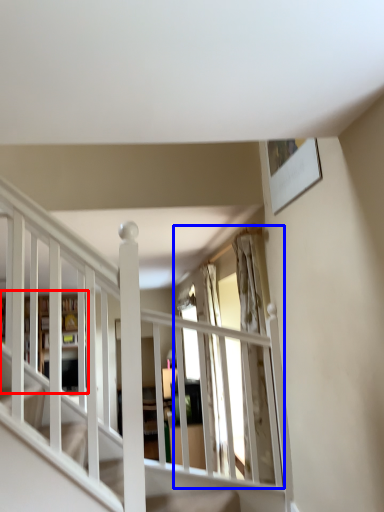
Question: Which of the following is the closest to the observer, bookshelf (highlighted by a red box) or window (highlighted by a blue box)?

Choices:
 (A) bookshelf
 (B) window

Answer: (B)